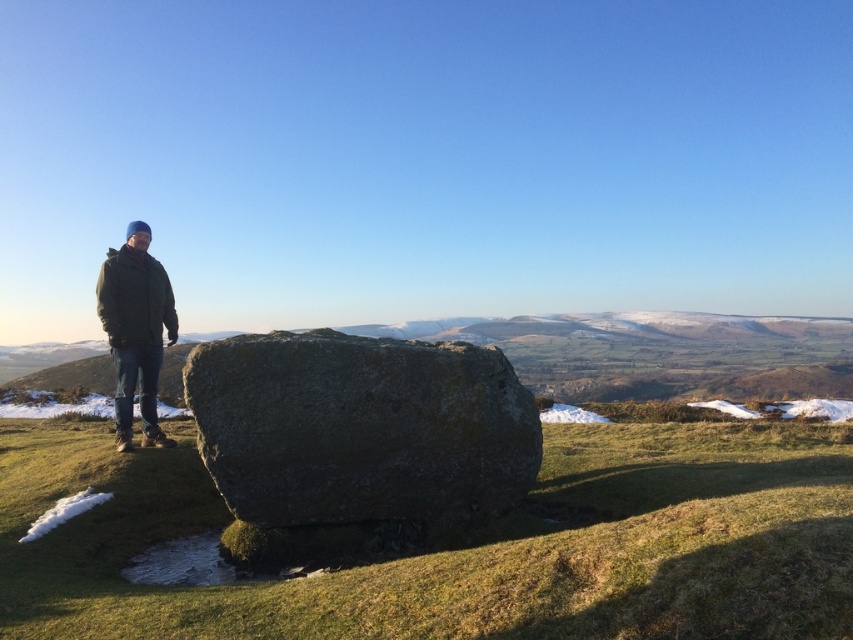
Question: Where is green mossy rock at center located in relation to green woolen jacket at left in the image?

Choices:
 (A) right
 (B) left

Answer: (A)

Question: Which is farther from the green woolen jacket at left?

Choices:
 (A) gray rough stone at center
 (B) green mossy rock at center

Answer: (B)

Question: Among these points, which one is nearest to the camera?

Choices:
 (A) (120, 394)
 (B) (546, 528)
 (C) (386, 428)

Answer: (C)

Question: Can you confirm if gray rough stone at center is wider than green woolen jacket at left?

Choices:
 (A) yes
 (B) no

Answer: (A)

Question: Which of the following is the farthest from the observer?

Choices:
 (A) green woolen jacket at left
 (B) gray rough stone at center
 (C) green mossy rock at center

Answer: (A)

Question: Does gray rough stone at center lie in front of green woolen jacket at left?

Choices:
 (A) yes
 (B) no

Answer: (A)